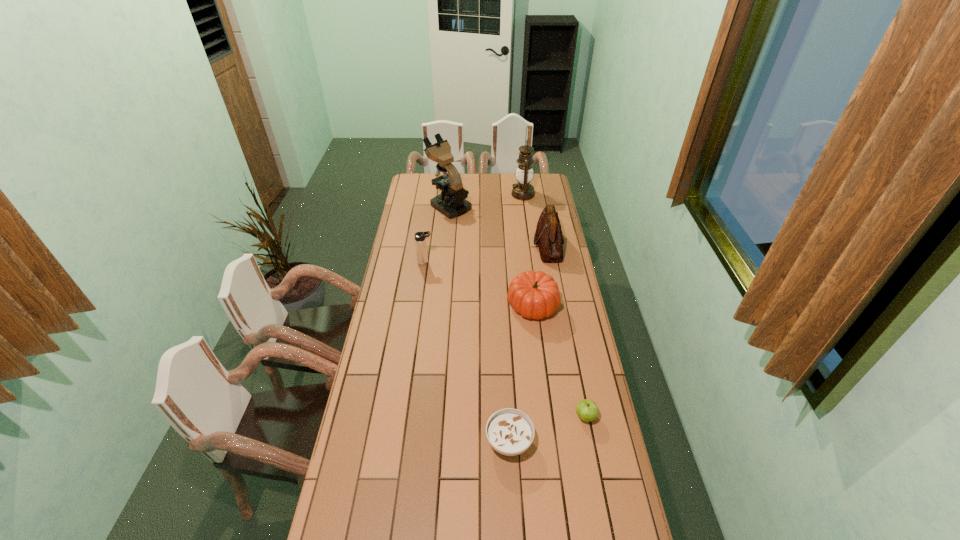
At what (x,y) coordinates should I click in order to perform the action: click on oil lamp. Please return your answer as a coordinate pair (x, y). Looking at the image, I should click on (523, 190).

Where is `microscope`? The width and height of the screenshot is (960, 540). microscope is located at coordinates (452, 203).

Find the location of a particular element. This screenshot has width=960, height=540. shoulder bag is located at coordinates (548, 236).

The image size is (960, 540). I want to click on thermos bottle, so click(x=420, y=242).

Find the location of `the third nearest object`. the third nearest object is located at coordinates (535, 295).

The image size is (960, 540). What are the coordinates of `the third shortest object` in the screenshot? It's located at (535, 295).

Locate an element on the screen. Image resolution: width=960 pixels, height=540 pixels. apple is located at coordinates (587, 410).

At what (x,y) coordinates should I click in order to perform the action: click on soup bowl. Please return your answer as a coordinate pair (x, y). The width and height of the screenshot is (960, 540). Looking at the image, I should click on (510, 432).

Where is `blank area located 0.140m on the front of the oil lamp`? Image resolution: width=960 pixels, height=540 pixels. blank area located 0.140m on the front of the oil lamp is located at coordinates (526, 216).

Locate an element on the screen. The width and height of the screenshot is (960, 540). free region located on the left of the microscope is located at coordinates (407, 206).